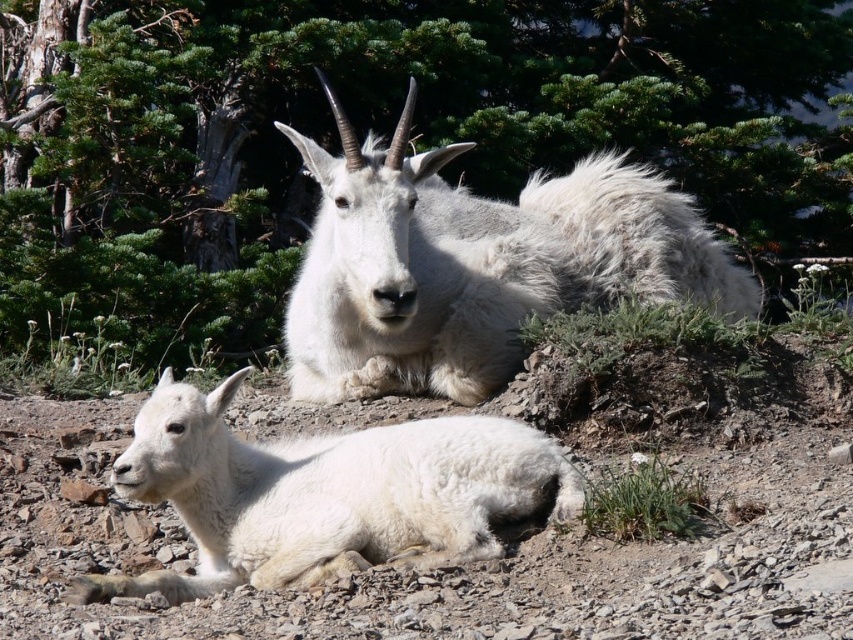
You are navigating a drone through a mountainous area and need to fly between two points marked as point (125, 172) and point (579, 273). According to the image, which point is closer to the camera?

Point (579, 273) is closer to the camera because it is in front of point (125, 172), which is behind it.

You are a hiker trying to take a photo of the white fluffy goat at center. You notice the green leafy tree at upper center is blocking part of the goat. Can you adjust your position to avoid the tree while still framing the goat in the center?

The green leafy tree at upper center is larger in size than white fluffy goat at center, so moving your camera angle slightly downward or to the side could help frame the goat without the tree blocking it.